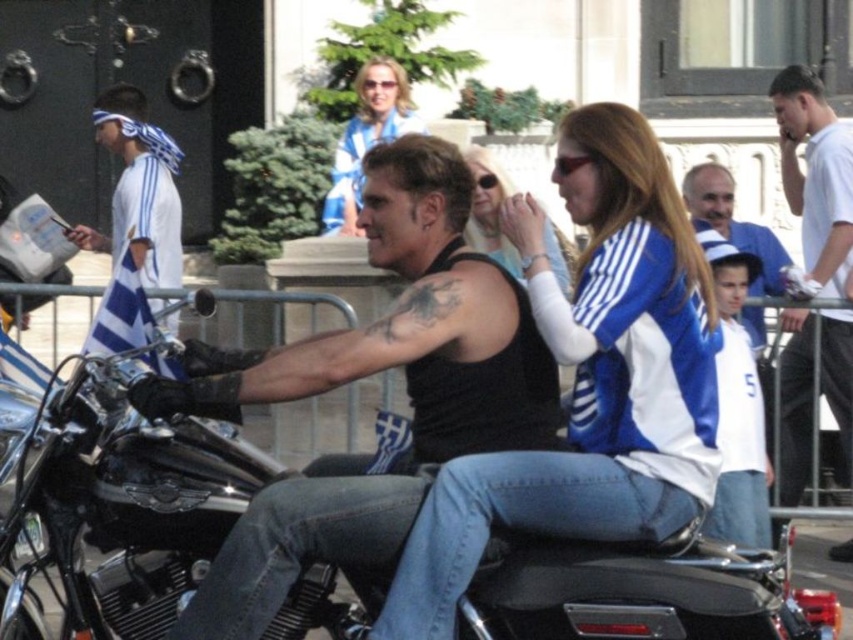
Question: Is the position of blue/white jersey at center more distant than that of white fabric headband at left?

Choices:
 (A) yes
 (B) no

Answer: (B)

Question: Which object appears closest to the camera in this image?

Choices:
 (A) blue/white jersey at center
 (B) blue and white jersey at upper right
 (C) white cotton shirt at upper right
 (D) shiny chrome motorcycle at center

Answer: (D)

Question: Based on their relative distances, which object is nearer to the blue/white jersey at center?

Choices:
 (A) blue and white jersey at center
 (B) blue and white jersey at upper right
 (C) black leather tank top at center
 (D) shiny chrome motorcycle at center

Answer: (C)

Question: Can you confirm if black leather tank top at center is smaller than matte blue and white jersey at center?

Choices:
 (A) no
 (B) yes

Answer: (A)

Question: Can you confirm if black leather tank top at center is thinner than matte blue and white jersey at center?

Choices:
 (A) yes
 (B) no

Answer: (B)

Question: Which of these objects is positioned farthest from the blue and white jersey at center?

Choices:
 (A) shiny chrome motorcycle at center
 (B) black leather tank top at center
 (C) matte blue and white jersey at center

Answer: (C)